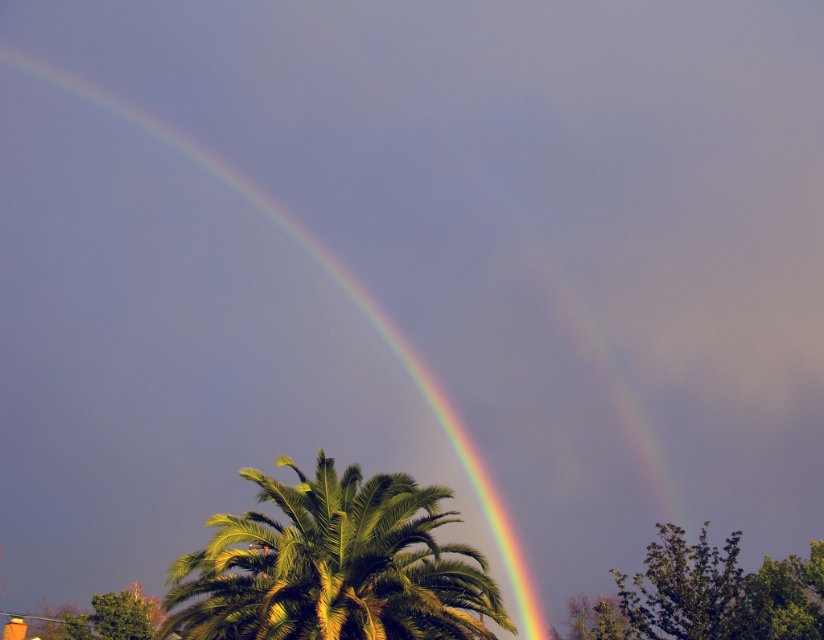
You are standing in the scene looking at the double rainbow. There is a point marked at coordinates [335,564]. What object is located at that point?

The green leafy palm tree at center is located at point [335,564].

You are a photographer trying to capture the rainbow at upper center without the green leafy palm tree at center appearing in the shot. Is it possible to position yourself so that the palm tree is not blocking the rainbow?

The green leafy palm tree at center is below the rainbow at upper center, so yes, you can position yourself to capture the rainbow at upper center without the palm tree blocking it since the palm tree is positioned lower in the frame.

You are standing in the scene and want to walk from the point at coordinates point (x=428, y=520) to the point at coordinates point (x=162, y=140). Will you pass in front of or behind the palm tree during your journey?

Since point (x=428, y=520) is in front of point (x=162, y=140), you will pass behind the palm tree during your journey.